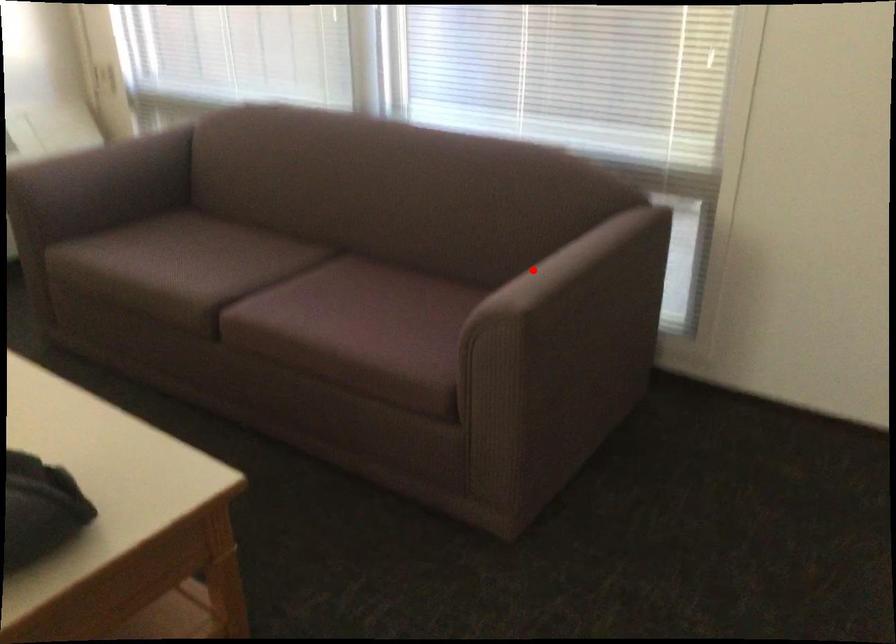
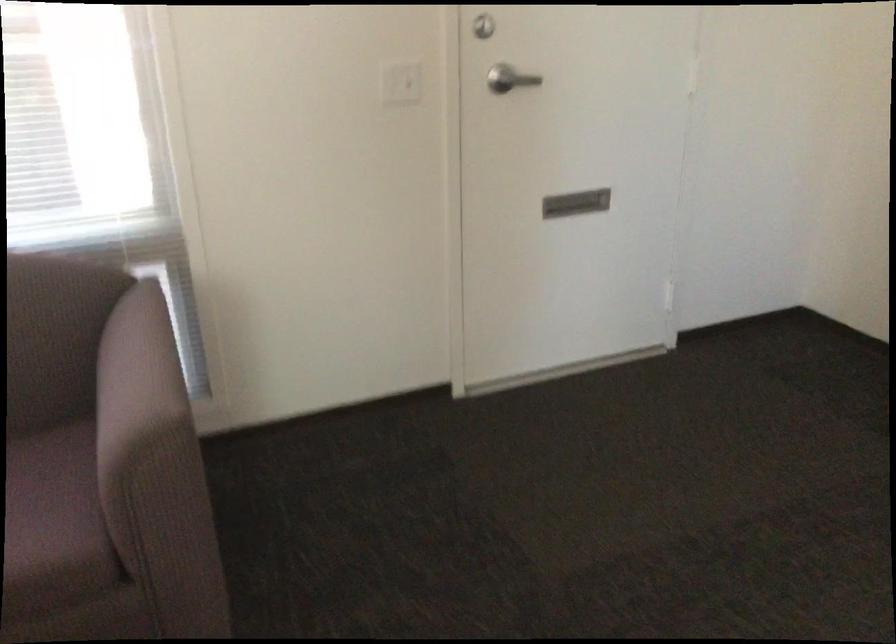
Question: I am providing you with two images of the same scene from different viewpoints. Given a red point in image1, look at the same physical point in image2. Is it:

Choices:
 (A) Closer to the viewpoint
 (B) Farther from the viewpoint

Answer: (A)